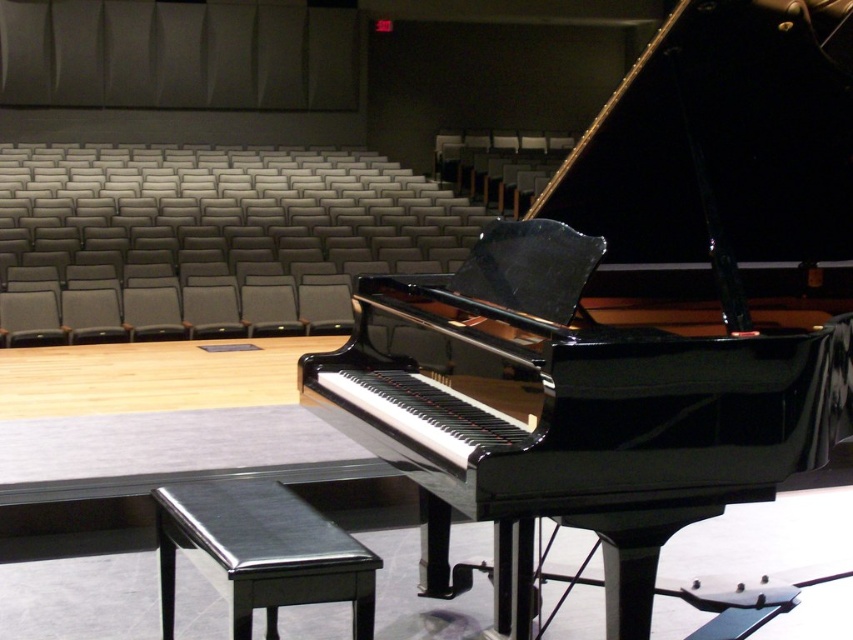
You are a stagehand who needs to move a 1.8 meter long piano cover to the glossy black piano at center. The cover must be placed directly in front of the piano. Is there enough space between you and the piano to lay it out fully?

The distance between the viewer and the glossy black piano at center is 2.04 meters. Since the piano cover is 1.8 meters long, there is sufficient space to lay it out fully in front of the piano.

You are an audience member sitting in the back row of the auditorium. You want to walk up to the shiny black stool at lower center to sit down. However, you need to avoid stepping on the gray carpet in front of the glossy black piano at center. Can you reach the stool without stepping on the carpet?

The glossy black piano at center is closer to the viewer than the shiny black stool at lower center, so you would have to walk past the piano first. Since the gray carpet is in front of the piano, you would need to step on it to reach the stool.

From the picture: You are standing at the entrance of the auditorium facing the stage. The glossy black piano at center is located at coordinates point 0.503, 0.741. If you want to walk directly to the piano, which direction should you head towards?

→ The glossy black piano at center is located at point (631, 321), so you should head towards the center of the stage to reach it.